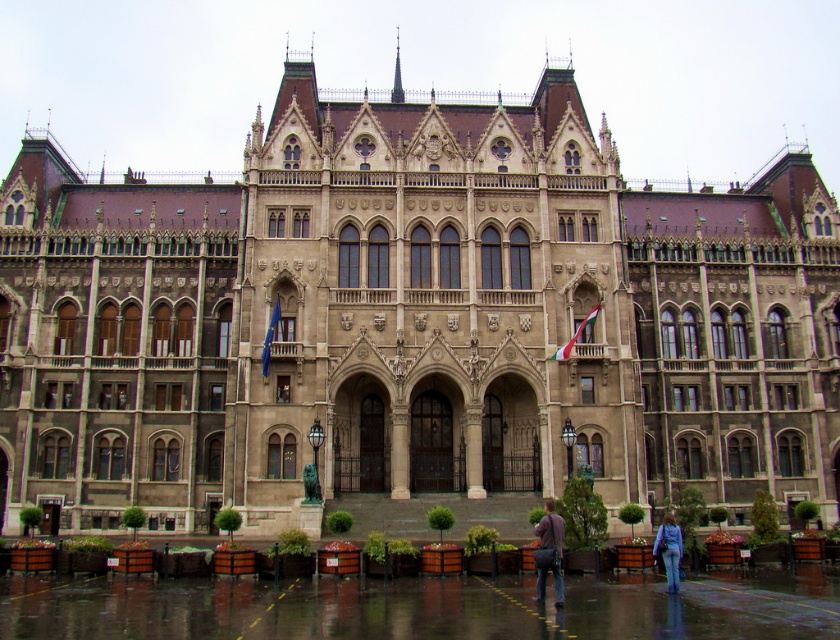
You are standing in front of the grand historic building and see the dark brown leather jacket at lower center and the purple fabric bag at lower right. Which object is located to the left of the other?

The dark brown leather jacket at lower center is positioned on the left side of purple fabric bag at lower right.

You are standing in front of the grand historic building and see the dark brown leather jacket at lower center and the purple fabric bag at lower right. Which object is taller?

The dark brown leather jacket at lower center is much taller than the purple fabric bag at lower right.